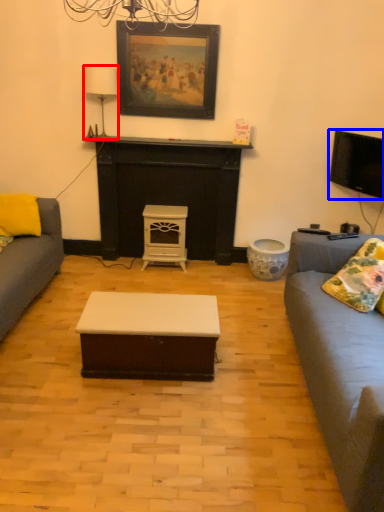
Question: Which of the following is the closest to the observer, lamp (highlighted by a red box) or television (highlighted by a blue box)?

Choices:
 (A) lamp
 (B) television

Answer: (B)